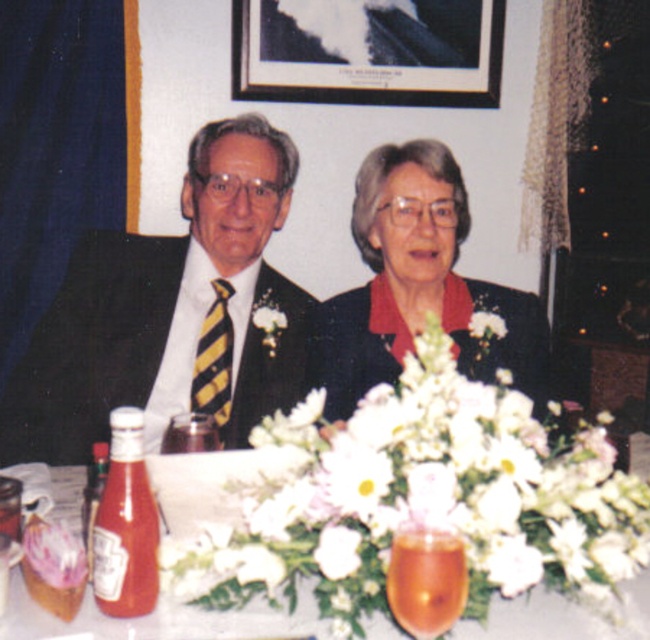
You are a photographer setting up for a formal event. You need to place a decorative item between the white matte flower at center and the matte glass bottle of ketchup at lower left. Based on their widths, which object should you place closer to the center of the table?

The white matte flower at center might be wider than the matte glass bottle of ketchup at lower left, so you should place the decorative item closer to the matte glass bottle of ketchup at lower left to maintain balance.

You are a photographer setting up for a formal event. You need to position a black matte picture frame at upper center and a matte glass bottle of ketchup at lower left on the table. According to the scene, where should you place the black matte picture frame relative to the matte glass bottle of ketchup?

The black matte picture frame at upper center should be placed to the right of the matte glass bottle of ketchup at lower left.